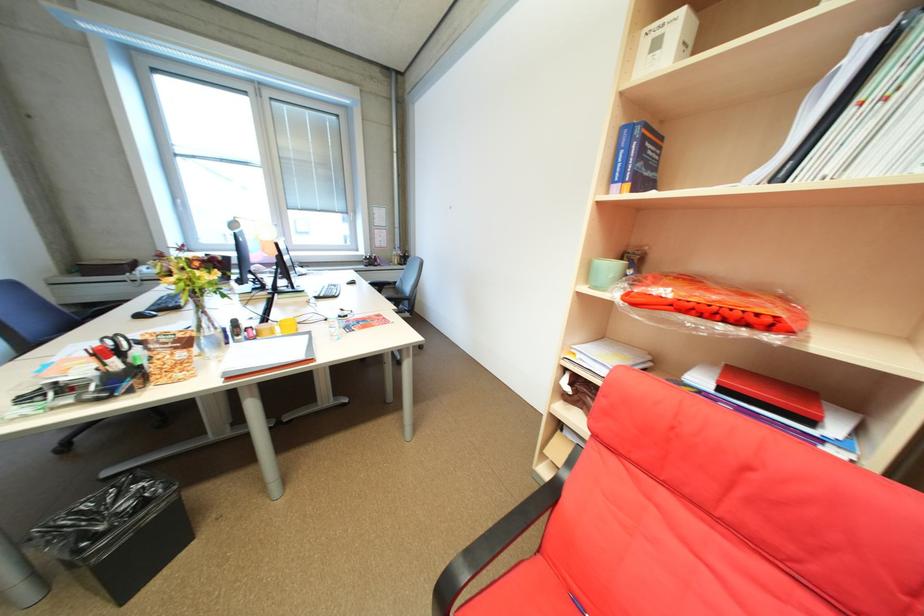
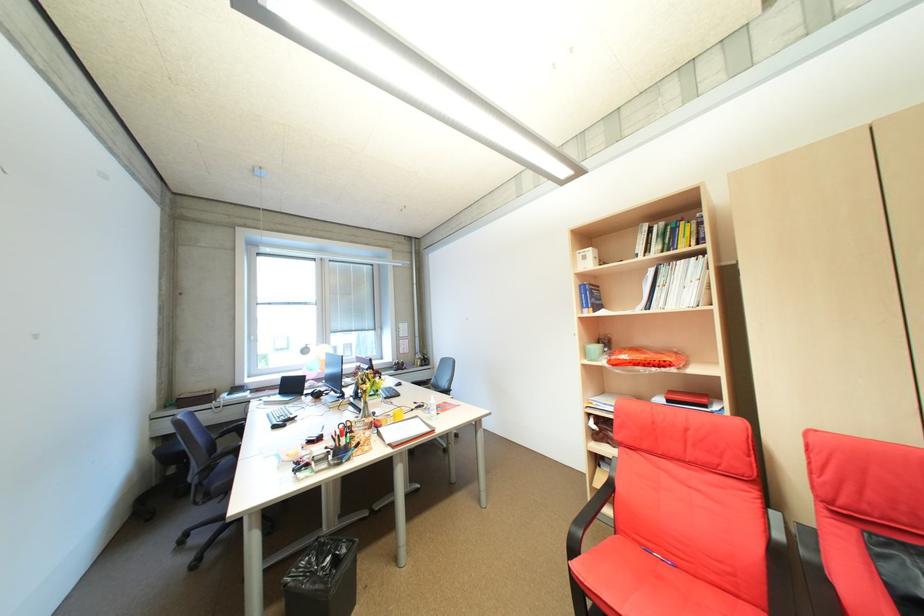
In the second image, find the point that corresponds to the point at 151,505 in the first image.

(345, 561)